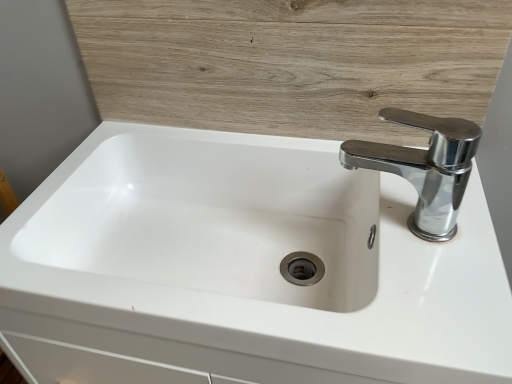
You are a GUI agent. You are given a task and a screenshot of the screen. Output one action in this format:
    pyautogui.click(x=<x>, y=<y>)
    Task: Click on the free space in front of chrome metallic faucet at upper right
    
    Given the screenshot: What is the action you would take?
    pyautogui.click(x=423, y=295)